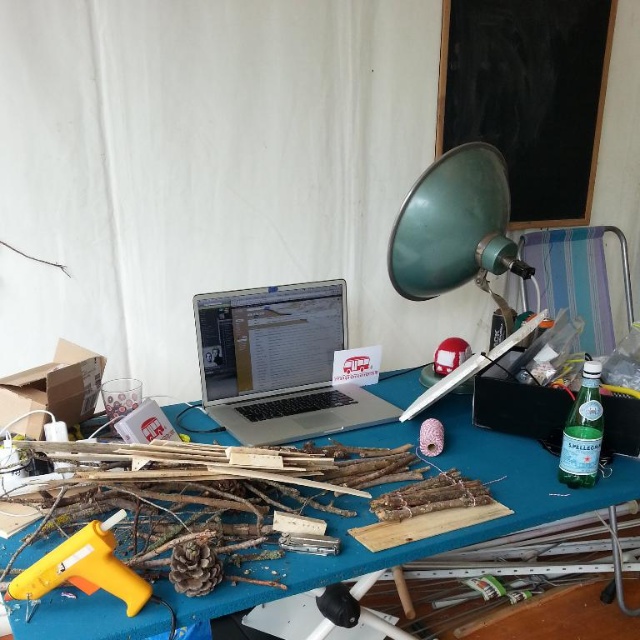
Who is more forward, (321, 355) or (106, 552)?

Point (106, 552) is in front.

Find the location of a particular element. silver metallic laptop at center is located at coordinates (280, 364).

Which is behind, point (202, 390) or point (52, 580)?

The point (202, 390) is behind.

Locate an element on the screen. The width and height of the screenshot is (640, 640). silver metallic laptop at center is located at coordinates (280, 364).

Can you confirm if blue wood table at center is positioned to the left of silver metallic laptop at center?

No, blue wood table at center is not to the left of silver metallic laptop at center.

This screenshot has width=640, height=640. What do you see at coordinates (438, 536) in the screenshot?
I see `blue wood table at center` at bounding box center [438, 536].

Is point (266, 593) positioned before point (241, 324)?

Yes, point (266, 593) is in front of point (241, 324).

Find the location of a particular element. This screenshot has width=640, height=640. blue wood table at center is located at coordinates (438, 536).

Which is more to the left, blue wood table at center or green matte lampshade at upper right?

From the viewer's perspective, blue wood table at center appears more on the left side.

Locate an element on the screen. This screenshot has height=640, width=640. blue wood table at center is located at coordinates (438, 536).

Does point (444, 400) lie in front of point (465, 282)?

That is True.

The height and width of the screenshot is (640, 640). Identify the location of blue wood table at center. (438, 536).